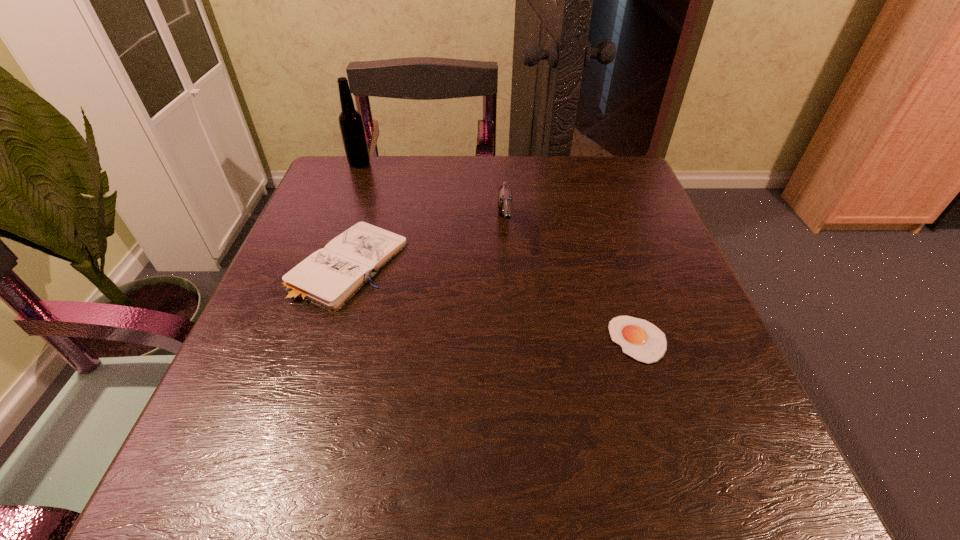
What are the coordinates of `vacant area situated on the left of the shortest object` in the screenshot? It's located at (394, 340).

The width and height of the screenshot is (960, 540). I want to click on beer bottle at the far edge, so click(351, 124).

Where is `pistol present at the far edge`? pistol present at the far edge is located at coordinates click(505, 198).

The image size is (960, 540). Find the location of `beer bottle at the left edge`. beer bottle at the left edge is located at coordinates (351, 124).

Find the location of a particular element. notebook situated at the left edge is located at coordinates (329, 277).

Image resolution: width=960 pixels, height=540 pixels. Identify the location of object that is positioned at the right edge. (640, 339).

Identify the location of object that is positioned at the far left corner. This screenshot has width=960, height=540. (351, 124).

Image resolution: width=960 pixels, height=540 pixels. Identify the location of vacant region at the far edge of the desktop. (406, 187).

Identify the location of free space at the left edge of the desktop. (280, 393).

In the image, there is a desktop. At what (x,y) coordinates should I click in order to perform the action: click on vacant space at the right edge. Please return your answer as a coordinate pair (x, y). The image size is (960, 540). Looking at the image, I should click on (732, 419).